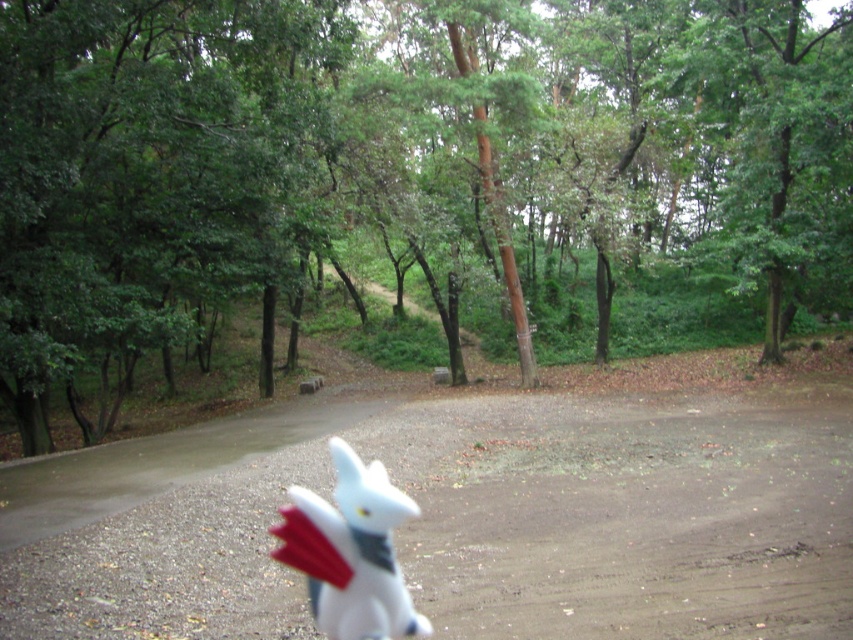
Question: Does green matte tree at center have a lesser width compared to white matte plush toy at center?

Choices:
 (A) yes
 (B) no

Answer: (B)

Question: Which point is farther to the camera?

Choices:
 (A) white matte plush toy at center
 (B) brown dirt track at center
 (C) green matte tree at center

Answer: (C)

Question: Does green matte tree at center appear over white matte plush toy at center?

Choices:
 (A) yes
 (B) no

Answer: (A)

Question: Which point appears farthest from the camera in this image?

Choices:
 (A) (697, 468)
 (B) (88, 284)

Answer: (B)

Question: Is brown dirt track at center thinner than white matte plush toy at center?

Choices:
 (A) no
 (B) yes

Answer: (A)

Question: Which of the following is the farthest from the observer?

Choices:
 (A) (769, 260)
 (B) (840, 568)
 (C) (367, 627)

Answer: (A)